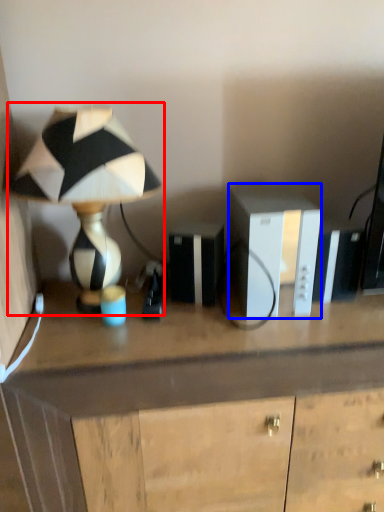
Question: Among these objects, which one is nearest to the camera, lamp (highlighted by a red box) or cabinetry (highlighted by a blue box)?

Choices:
 (A) lamp
 (B) cabinetry

Answer: (A)